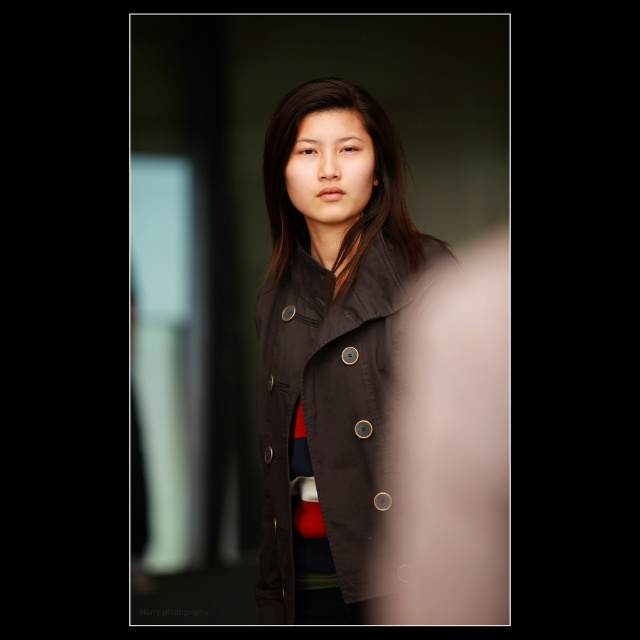
Which is more to the right, matte brown jacket at center or matte black coat at center?

matte black coat at center is more to the right.

Which is more to the left, matte brown jacket at center or matte black coat at center?

Positioned to the left is matte brown jacket at center.

The image size is (640, 640). What do you see at coordinates (324, 412) in the screenshot?
I see `matte brown jacket at center` at bounding box center [324, 412].

This screenshot has height=640, width=640. What are the coordinates of `matte brown jacket at center` in the screenshot? It's located at 324,412.